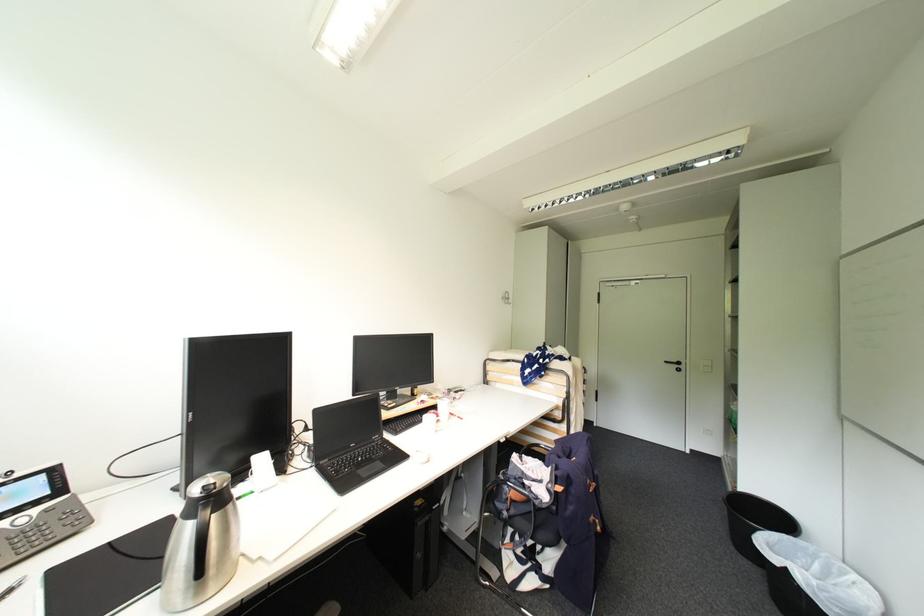
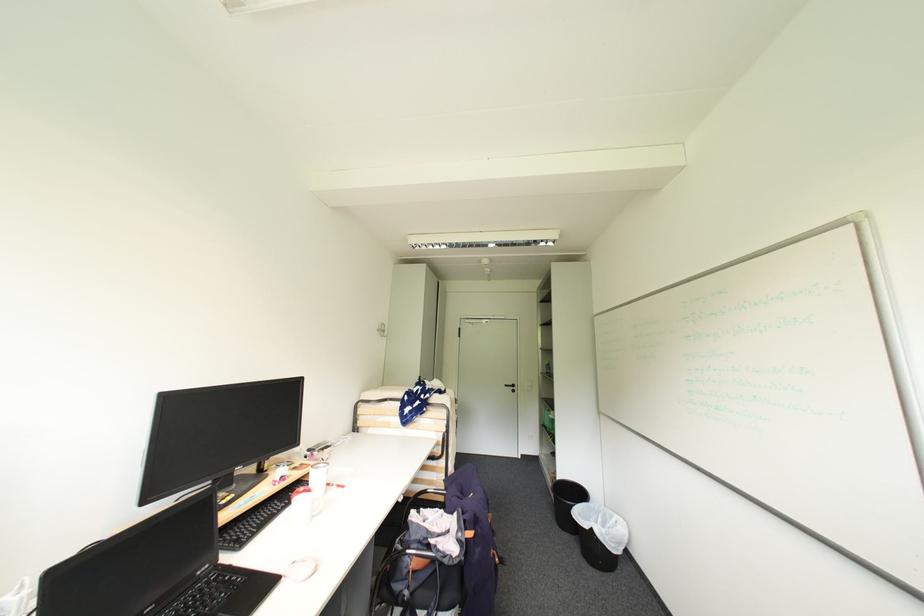
Locate, in the second image, the point that corresponds to pixel 508 299 in the first image.

(384, 331)